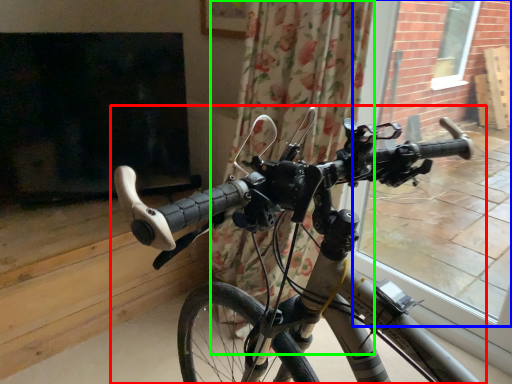
Question: Which object is the farthest from bicycle (highlighted by a red box)? Choose among these: window frame (highlighted by a blue box) or curtain (highlighted by a green box).

Choices:
 (A) window frame
 (B) curtain

Answer: (A)